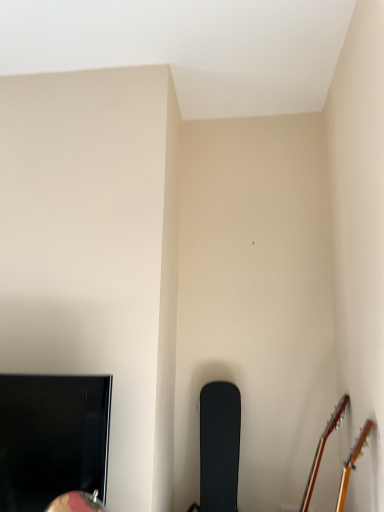
Describe the element at coordinates (323, 450) in the screenshot. Image resolution: width=384 pixels, height=512 pixels. I see `wooden acoustic guitar at right` at that location.

Identify the location of wooden acoustic guitar at right. Image resolution: width=384 pixels, height=512 pixels. (323, 450).

This screenshot has width=384, height=512. I want to click on wooden acoustic guitar at right, so click(323, 450).